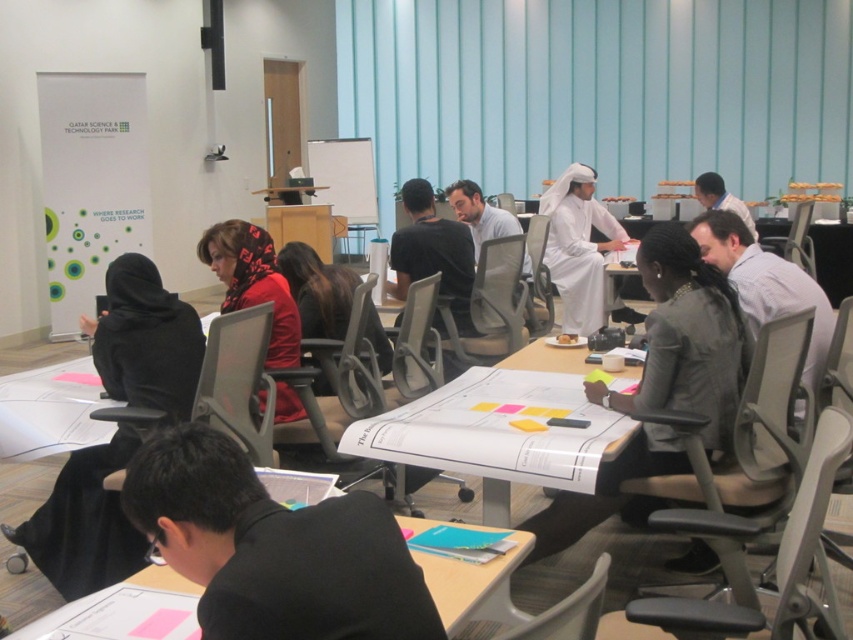
Measure the distance from white paper at lower center to matte black chair at center.

They are 5.68 feet apart.

Which of these two, white paper at lower center or matte black chair at center, stands shorter?

white paper at lower center

Image resolution: width=853 pixels, height=640 pixels. Describe the element at coordinates (467, 580) in the screenshot. I see `white paper at lower center` at that location.

The image size is (853, 640). In order to click on white paper at lower center in this screenshot , I will do `click(467, 580)`.

Is white matte robe at center positioned behind silky red dress at center?

Yes, it is behind silky red dress at center.

Can you confirm if white matte robe at center is taller than silky red dress at center?

Indeed, white matte robe at center has a greater height compared to silky red dress at center.

Find the location of a particular element. This screenshot has height=640, width=853. white matte robe at center is located at coordinates (578, 248).

Locate an element on the screen. The image size is (853, 640). white matte robe at center is located at coordinates (578, 248).

The width and height of the screenshot is (853, 640). What do you see at coordinates (253, 282) in the screenshot? I see `silky red dress at center` at bounding box center [253, 282].

Measure the distance between point (x=228, y=220) and camera.

Point (x=228, y=220) is 17.25 feet from camera.

Measure the distance between point [262,300] and camera.

10.58 feet

What are the coordinates of `silky red dress at center` in the screenshot? It's located at pyautogui.click(x=253, y=282).